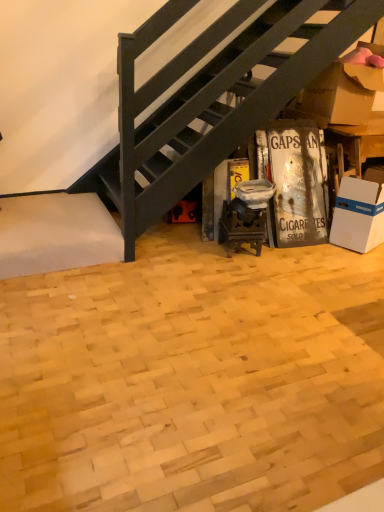
Question: Relative to natural wood parquet floor at center, is brown cardboard box at upper right in front or behind?

Choices:
 (A) front
 (B) behind

Answer: (B)

Question: Considering the positions of brown cardboard box at upper right and natural wood parquet floor at center in the image, is brown cardboard box at upper right bigger or smaller than natural wood parquet floor at center?

Choices:
 (A) big
 (B) small

Answer: (B)

Question: Which of these objects is positioned farthest from the brown cardboard box at upper right?

Choices:
 (A) white cardboard box at lower right
 (B) natural wood parquet floor at center

Answer: (B)

Question: Which object is the farthest from the natural wood parquet floor at center?

Choices:
 (A) brown cardboard box at upper right
 (B) white cardboard box at lower right

Answer: (A)